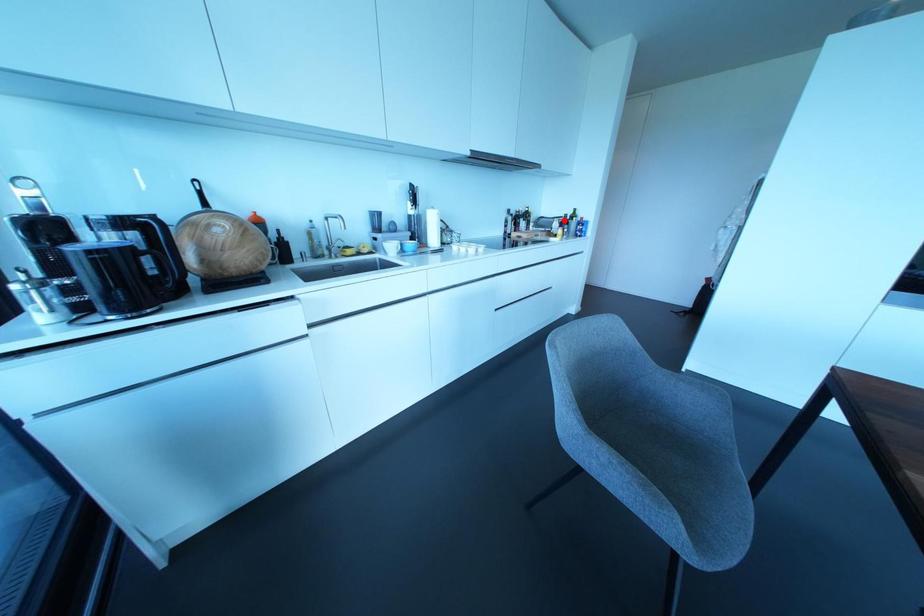
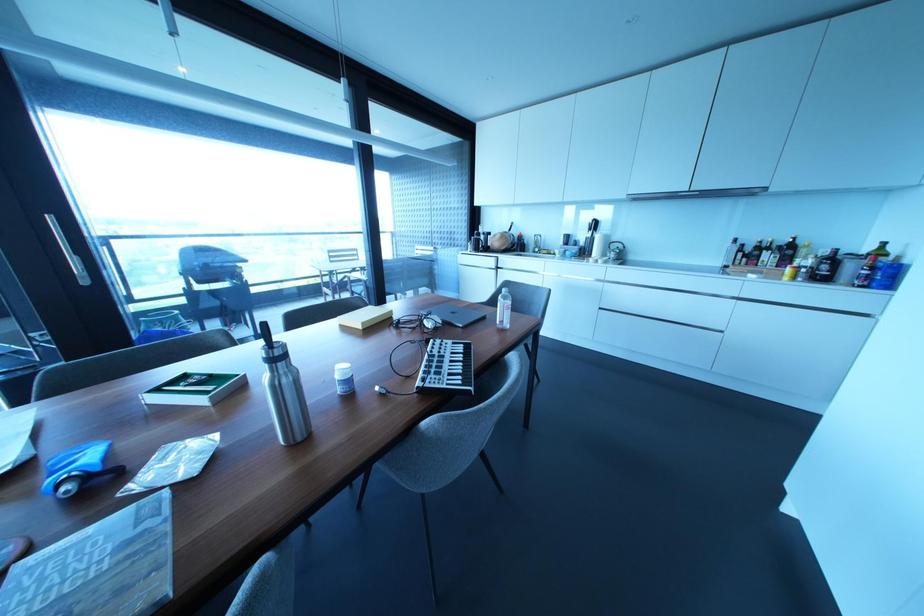
In the second image, find the point that corresponds to the highlighted location in the first image.

(833, 257)